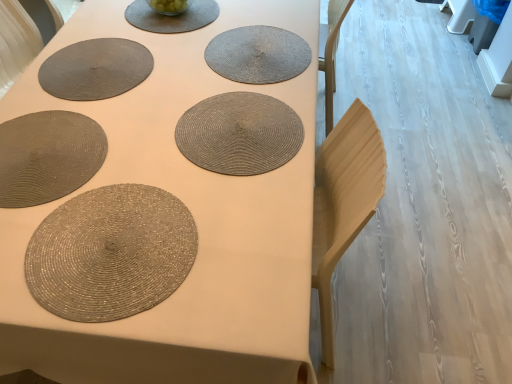
Where is `vacant space that's between matte gray placemat at upper center and shiny metallic placemat at bottom left, which appears as the third paper plate when viewed from the back`? vacant space that's between matte gray placemat at upper center and shiny metallic placemat at bottom left, which appears as the third paper plate when viewed from the back is located at coordinates (137, 104).